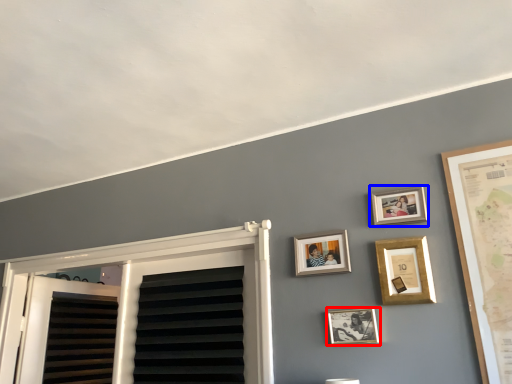
Question: Among these objects, which one is farthest to the camera, picture frame (highlighted by a red box) or picture frame (highlighted by a blue box)?

Choices:
 (A) picture frame
 (B) picture frame

Answer: (B)